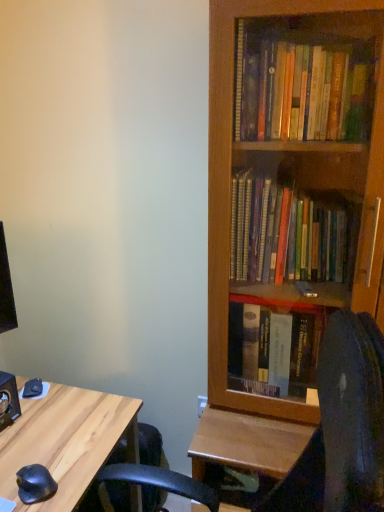
The image size is (384, 512). I want to click on light wood desk at lower left, so click(66, 441).

At what (x,y) coordinates should I click in order to perform the action: click on black leather computer chair at lower right. Please return your answer as a coordinate pair (x, y). Looking at the image, I should click on (342, 426).

Measure the distance between black leather computer chair at lower right and camera.

A distance of 18.31 inches exists between black leather computer chair at lower right and camera.

Locate an element on the screen. The width and height of the screenshot is (384, 512). wooden bookcase at right is located at coordinates (230, 191).

The image size is (384, 512). What are the coordinates of `black rubber mouse at lower left` in the screenshot? It's located at (35, 484).

Is light wood desk at lower left bigger than black rubber mouse at lower left?

Correct, light wood desk at lower left is larger in size than black rubber mouse at lower left.

Is point (100, 438) closer to camera compared to point (37, 467)?

No, (100, 438) is behind (37, 467).

From the image's perspective, which one is positioned lower, light wood desk at lower left or black rubber mouse at lower left?

From the image's view, light wood desk at lower left is below.

Can you tell me how much light wood desk at lower left and black rubber mouse at lower left differ in facing direction?

23.2 degrees.

From the image's perspective, which one is positioned lower, black leather computer chair at lower right or black rubber mouse at lower left?

black rubber mouse at lower left appears lower in the image.

From a real-world perspective, is black leather computer chair at lower right physically above black rubber mouse at lower left?

Correct, in the physical world, black leather computer chair at lower right is higher than black rubber mouse at lower left.

Which is in front, point (200, 489) or point (21, 480)?

Positioned in front is point (21, 480).

Where is `bookcase located in front of the black rubber mouse at lower left`? bookcase located in front of the black rubber mouse at lower left is located at coordinates (230, 191).

Is wooden bookcase at right behind black rubber mouse at lower left?

No, it is not.

Looking at this image, how many degrees apart are the facing directions of wooden bookcase at right and black rubber mouse at lower left?

65 degrees separate the facing orientations of wooden bookcase at right and black rubber mouse at lower left.

Is point (219, 298) closer to camera compared to point (56, 490)?

No, it is behind (56, 490).

Based on the photo, are wooden bookcase at right and black leather computer chair at lower right far apart?

They are positioned close to each other.

How different are the orientations of wooden bookcase at right and black leather computer chair at lower right in degrees?

89.3 degrees.

Which object is closer to the camera, wooden bookcase at right or black leather computer chair at lower right?

black leather computer chair at lower right is closer to the camera.

Is wooden bookcase at right thinner than black leather computer chair at lower right?

Yes, wooden bookcase at right is thinner than black leather computer chair at lower right.

Is black leather computer chair at lower right inside or outside of light wood desk at lower left?

black leather computer chair at lower right exists outside the volume of light wood desk at lower left.

From the image's perspective, is black leather computer chair at lower right on light wood desk at lower left?

Yes, from the image's perspective, black leather computer chair at lower right is over light wood desk at lower left.

Can you confirm if black leather computer chair at lower right is positioned to the left of light wood desk at lower left?

No, black leather computer chair at lower right is not to the left of light wood desk at lower left.

Does black rubber mouse at lower left appear on the left side of light wood desk at lower left?

No.

Consider the image. Is black rubber mouse at lower left in front of or behind light wood desk at lower left in the image?

Visually, black rubber mouse at lower left is located behind light wood desk at lower left.

How different are the orientations of black rubber mouse at lower left and light wood desk at lower left in degrees?

black rubber mouse at lower left and light wood desk at lower left are facing 23.2 degrees away from each other.

Could you tell me if black rubber mouse at lower left is turned towards light wood desk at lower left?

No, black rubber mouse at lower left does not turn towards light wood desk at lower left.

Based on their sizes in the image, would you say light wood desk at lower left is bigger or smaller than black leather computer chair at lower right?

Clearly, light wood desk at lower left is smaller in size than black leather computer chair at lower right.

In the scene shown: Which of these two, light wood desk at lower left or black leather computer chair at lower right, stands shorter?

With less height is light wood desk at lower left.

From the picture: Who is more distant, light wood desk at lower left or black leather computer chair at lower right?

light wood desk at lower left is further away from the camera.

Identify the location of desk lying in front of the black rubber mouse at lower left. The width and height of the screenshot is (384, 512). (66, 441).

Identify the location of computer chair that appears above the black rubber mouse at lower left (from the image's perspective). (342, 426).

Considering their positions, is wooden bookcase at right positioned further to black rubber mouse at lower left than black leather computer chair at lower right?

wooden bookcase at right lies further to black rubber mouse at lower left than the other object.

From the image, which object appears to be nearer to black leather computer chair at lower right, wooden bookcase at right or black rubber mouse at lower left?

wooden bookcase at right.

Estimate the real-world distances between objects in this image. Which object is closer to wooden bookcase at right, black leather computer chair at lower right or light wood desk at lower left?

Based on the image, black leather computer chair at lower right appears to be nearer to wooden bookcase at right.

In the scene shown: Considering their positions, is light wood desk at lower left positioned closer to wooden bookcase at right than black leather computer chair at lower right?

black leather computer chair at lower right is closer to wooden bookcase at right.

In the scene shown: From the image, which object appears to be nearer to black rubber mouse at lower left, light wood desk at lower left or black leather computer chair at lower right?

light wood desk at lower left lies closer to black rubber mouse at lower left than the other object.

Looking at this image, looking at the image, which one is located further to light wood desk at lower left, wooden bookcase at right or black leather computer chair at lower right?

The object further to light wood desk at lower left is wooden bookcase at right.

From the image, which object appears to be farther from light wood desk at lower left, black leather computer chair at lower right or wooden bookcase at right?

The object further to light wood desk at lower left is wooden bookcase at right.

Considering their positions, is black rubber mouse at lower left positioned closer to black leather computer chair at lower right than light wood desk at lower left?

Among the two, light wood desk at lower left is located nearer to black leather computer chair at lower right.

Locate an element on the screen. The image size is (384, 512). mouse located between light wood desk at lower left and wooden bookcase at right in the left-right direction is located at coordinates (35, 484).

What are the coordinates of `computer chair between light wood desk at lower left and wooden bookcase at right` in the screenshot? It's located at (342, 426).

Where is `desk between black leather computer chair at lower right and black rubber mouse at lower left from front to back`? The width and height of the screenshot is (384, 512). desk between black leather computer chair at lower right and black rubber mouse at lower left from front to back is located at coordinates (66, 441).

Where is `bookcase located between black leather computer chair at lower right and black rubber mouse at lower left in the depth direction`? bookcase located between black leather computer chair at lower right and black rubber mouse at lower left in the depth direction is located at coordinates (230, 191).